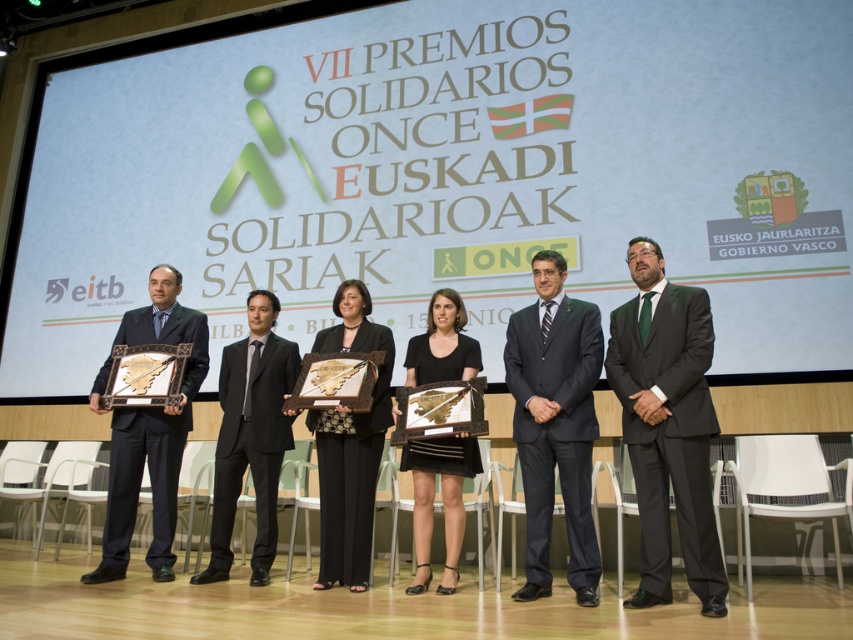
Question: Among these points, which one is farthest from the camera?

Choices:
 (A) (554, 428)
 (B) (262, 346)

Answer: (B)

Question: Which point is farther to the camera?

Choices:
 (A) black textured dress at center
 (B) matte gold frame at left

Answer: (B)

Question: Does dark blue suit at center appear under matte gold frame at left?

Choices:
 (A) no
 (B) yes

Answer: (A)

Question: Is dark blue suit at center below black satin suit at center?

Choices:
 (A) no
 (B) yes

Answer: (A)

Question: Does dark blue suit at center have a smaller size compared to black textured dress at center?

Choices:
 (A) yes
 (B) no

Answer: (B)

Question: Which point is farther to the camera?

Choices:
 (A) black textured dress at center
 (B) black satin dress at center

Answer: (A)